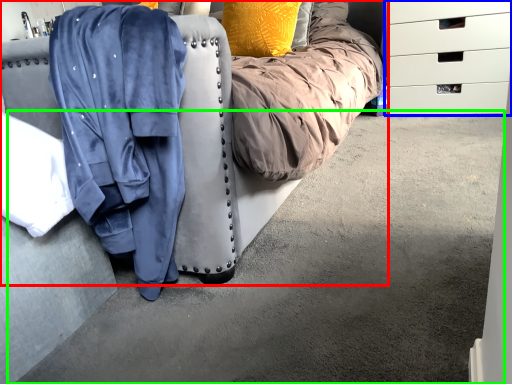
Question: Estimate the real-world distances between objects in this image. Which object is farther from furniture (highlighted by a red box), chest of drawers (highlighted by a blue box) or concrete (highlighted by a green box)?

Choices:
 (A) chest of drawers
 (B) concrete

Answer: (A)